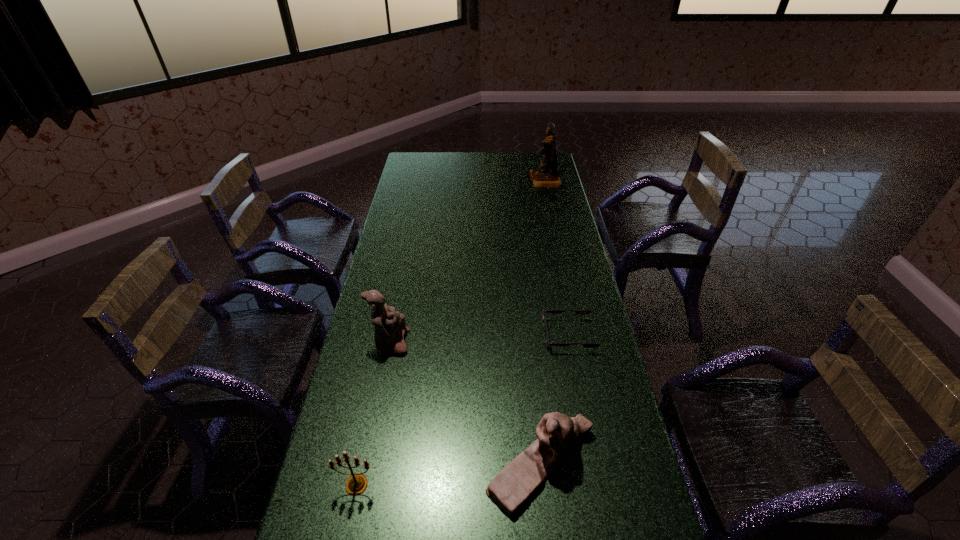
Locate an element on the screen. The width and height of the screenshot is (960, 540). free space located on the front-facing side of the second tallest figurine is located at coordinates (474, 342).

Identify the location of free location located 0.120m on the front-facing side of the shortest figurine. (439, 462).

Identify the location of free space located on the front-facing side of the shortest figurine. The width and height of the screenshot is (960, 540). (454, 462).

In order to click on vacant space located on the front-facing side of the shortest figurine in this screenshot , I will do `click(443, 462)`.

In order to click on vacant space situated on the right of the candelabrum in this screenshot , I will do `click(408, 485)`.

The image size is (960, 540). I want to click on vacant region located on the temples of the sunglasses, so click(x=510, y=335).

Identify the location of vacant region located on the temples of the sunglasses. The width and height of the screenshot is (960, 540). (424, 335).

Find the location of a particular element. free space located 0.090m on the temples of the sunglasses is located at coordinates (516, 335).

The image size is (960, 540). I want to click on object at the far edge, so click(x=546, y=175).

In order to click on figurine positioned at the left edge in this screenshot , I will do `click(390, 327)`.